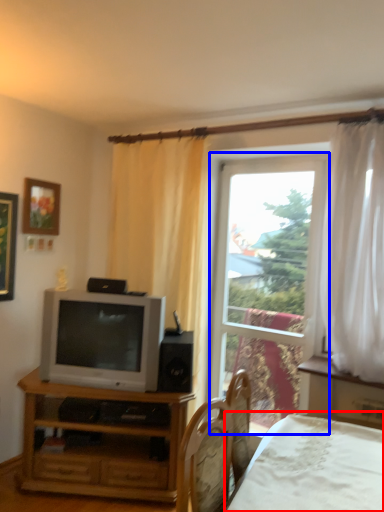
Question: Which object appears closest to the camera in this image, bed (highlighted by a red box) or window (highlighted by a blue box)?

Choices:
 (A) bed
 (B) window

Answer: (A)